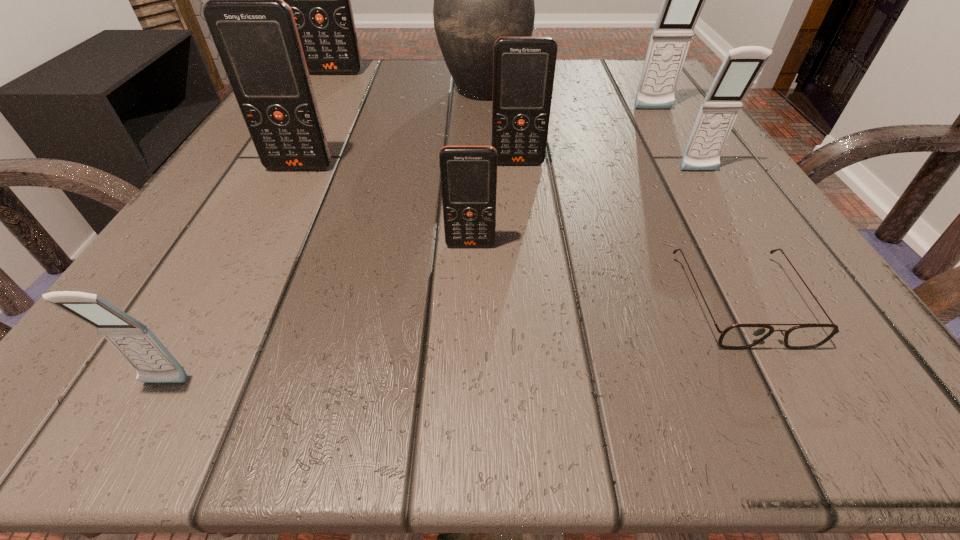
You are a GUI agent. You are given a task and a screenshot of the screen. Output one action in this format:
    pyautogui.click(x=<x>, y=<y>)
    Task: Click on the free location located 0.060m on the front-facing side of the eighth farthest object
    
    Given the screenshot: What is the action you would take?
    pyautogui.click(x=797, y=406)

You are a GUI agent. You are given a task and a screenshot of the screen. Output one action in this format:
    pyautogui.click(x=<x>, y=<y>)
    Task: Click on the pitcher positioned at the far edge
    
    Given the screenshot: What is the action you would take?
    pyautogui.click(x=477, y=0)

What are the coordinates of `cellular telephone that is positioned at the near edge` in the screenshot? It's located at (133, 340).

Image resolution: width=960 pixels, height=540 pixels. What are the coordinates of `sunglasses that is at the near edge` in the screenshot? It's located at pos(738,336).

Identify the location of sunglasses that is at the right edge. Image resolution: width=960 pixels, height=540 pixels. (738, 336).

At what (x,y) coordinates should I click in order to perform the action: click on object situated at the far left corner. Please return your answer as a coordinate pair (x, y). The width and height of the screenshot is (960, 540). Looking at the image, I should click on (320, 0).

I want to click on object located at the near left corner, so click(x=133, y=340).

The width and height of the screenshot is (960, 540). I want to click on object at the far right corner, so click(x=683, y=0).

This screenshot has width=960, height=540. I want to click on object that is at the near right corner, so click(738, 336).

Identify the location of free space at the far edge of the desktop. The width and height of the screenshot is (960, 540). (x=426, y=62).